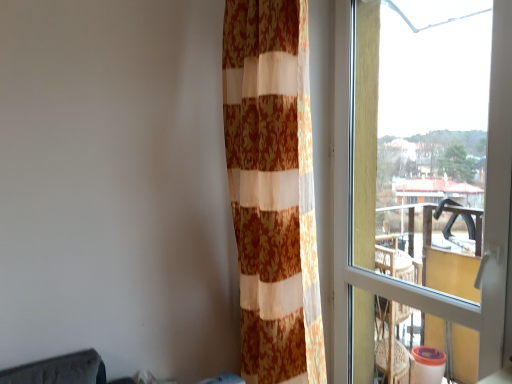
Image resolution: width=512 pixels, height=384 pixels. What do you see at coordinates (273, 189) in the screenshot?
I see `orange floral fabric curtain at center` at bounding box center [273, 189].

Locate an element on the screen. The width and height of the screenshot is (512, 384). orange floral fabric curtain at center is located at coordinates (273, 189).

What is the approximate height of transparent glass window at right?

The height of transparent glass window at right is 1.78 meters.

The width and height of the screenshot is (512, 384). Find the location of `transparent glass window at right`. transparent glass window at right is located at coordinates (485, 220).

What do you see at coordinates (485, 220) in the screenshot? I see `transparent glass window at right` at bounding box center [485, 220].

This screenshot has height=384, width=512. I want to click on orange floral fabric curtain at center, so click(273, 189).

Is transparent glass window at right to the left of orange floral fabric curtain at center from the viewer's perspective?

No, transparent glass window at right is not to the left of orange floral fabric curtain at center.

Which object is closer to the camera taking this photo, transparent glass window at right or orange floral fabric curtain at center?

transparent glass window at right is in front.

Is point (351, 130) positioned after point (236, 60)?

Yes, point (351, 130) is behind point (236, 60).

From the image's perspective, which object appears higher, transparent glass window at right or orange floral fabric curtain at center?

orange floral fabric curtain at center appears higher in the image.

From a real-world perspective, which object stands above the other?

orange floral fabric curtain at center is physically above.

Is transparent glass window at right wider or thinner than orange floral fabric curtain at center?

In the image, transparent glass window at right appears to be more narrow than orange floral fabric curtain at center.

Considering the sizes of objects transparent glass window at right and orange floral fabric curtain at center in the image provided, who is taller, transparent glass window at right or orange floral fabric curtain at center?

orange floral fabric curtain at center is taller.

Is transparent glass window at right bigger than orange floral fabric curtain at center?

No, transparent glass window at right is not bigger than orange floral fabric curtain at center.

Is transparent glass window at right positioned beyond the bounds of orange floral fabric curtain at center?

transparent glass window at right is positioned outside orange floral fabric curtain at center.

From the picture: Is transparent glass window at right with orange floral fabric curtain at center?

No, transparent glass window at right is not touching orange floral fabric curtain at center.

Is transparent glass window at right facing towards orange floral fabric curtain at center?

Yes, transparent glass window at right faces towards orange floral fabric curtain at center.

Measure the distance between transparent glass window at right and orange floral fabric curtain at center.

A distance of 17.31 inches exists between transparent glass window at right and orange floral fabric curtain at center.

Where is `window on the right of orange floral fabric curtain at center`? window on the right of orange floral fabric curtain at center is located at coordinates (485, 220).

Which is more to the right, orange floral fabric curtain at center or transparent glass window at right?

transparent glass window at right.

Relative to transparent glass window at right, is orange floral fabric curtain at center in front or behind?

Visually, orange floral fabric curtain at center is located behind transparent glass window at right.

Considering the points (253, 311) and (339, 256), which point is behind, point (253, 311) or point (339, 256)?

Positioned behind is point (339, 256).

Based on the photo, from the image's perspective, is orange floral fabric curtain at center beneath transparent glass window at right?

Actually, orange floral fabric curtain at center appears above transparent glass window at right in the image.

From a real-world perspective, which object stands above the other?

From a 3D spatial view, orange floral fabric curtain at center is above.

Based on the photo, does orange floral fabric curtain at center have a greater width compared to transparent glass window at right?

Correct, the width of orange floral fabric curtain at center exceeds that of transparent glass window at right.

Does orange floral fabric curtain at center have a lesser height compared to transparent glass window at right?

No.

Is orange floral fabric curtain at center smaller than transparent glass window at right?

Actually, orange floral fabric curtain at center might be larger than transparent glass window at right.

Is orange floral fabric curtain at center completely or partially outside of transparent glass window at right?

orange floral fabric curtain at center is positioned outside transparent glass window at right.

In the scene shown: Is there a large distance between orange floral fabric curtain at center and transparent glass window at right?

orange floral fabric curtain at center is near transparent glass window at right, not far away.

Could you tell me if orange floral fabric curtain at center is turned towards transparent glass window at right?

No.

Where is `curtain on the left side of transparent glass window at right`? curtain on the left side of transparent glass window at right is located at coordinates (273, 189).

Locate an element on the screen. The image size is (512, 384). window below the orange floral fabric curtain at center (from the image's perspective) is located at coordinates (485, 220).

Identify the location of window that is in front of the orange floral fabric curtain at center. (485, 220).